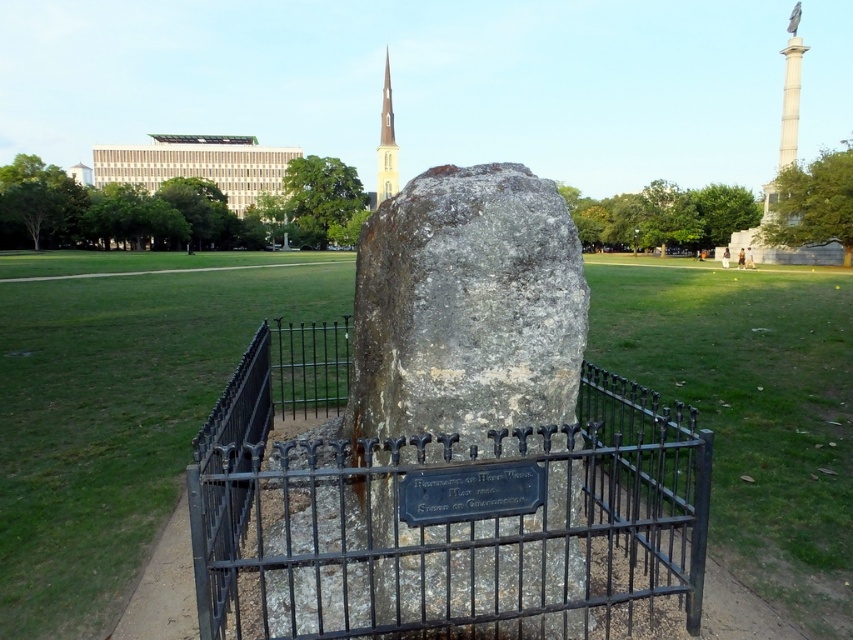
Question: Which point is farther to the camera?

Choices:
 (A) (509, 262)
 (B) (297, 480)
 (C) (384, 156)

Answer: (C)

Question: In this image, where is black wrought iron fence at center located relative to smooth white spire at upper center?

Choices:
 (A) above
 (B) below

Answer: (B)

Question: In this image, where is black wrought iron fence at center located relative to smooth white spire at upper center?

Choices:
 (A) right
 (B) left

Answer: (A)

Question: Which point is farther to the camera?

Choices:
 (A) smooth white spire at upper center
 (B) gray stone at center
 (C) black wrought iron fence at center

Answer: (A)

Question: Does black wrought iron fence at center appear over smooth white spire at upper center?

Choices:
 (A) no
 (B) yes

Answer: (A)

Question: Which of the following is the closest to the observer?

Choices:
 (A) (434, 243)
 (B) (430, 506)

Answer: (B)